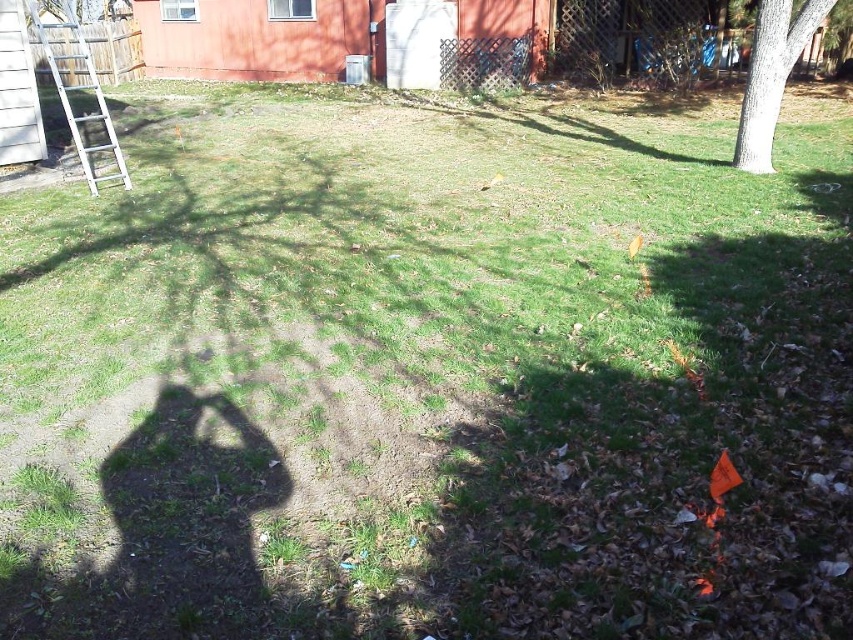
Question: Which point is farther from the camera taking this photo?

Choices:
 (A) (85, 48)
 (B) (798, 22)

Answer: (A)

Question: Can you confirm if white smooth tree at upper right is wider than white metallic ladder at left?

Choices:
 (A) no
 (B) yes

Answer: (A)

Question: Is white smooth tree at upper right further to the viewer compared to white metallic ladder at left?

Choices:
 (A) no
 (B) yes

Answer: (A)

Question: Does white smooth tree at upper right appear under white metallic ladder at left?

Choices:
 (A) yes
 (B) no

Answer: (A)

Question: Which point is farther to the camera?

Choices:
 (A) (798, 17)
 (B) (47, 48)

Answer: (B)